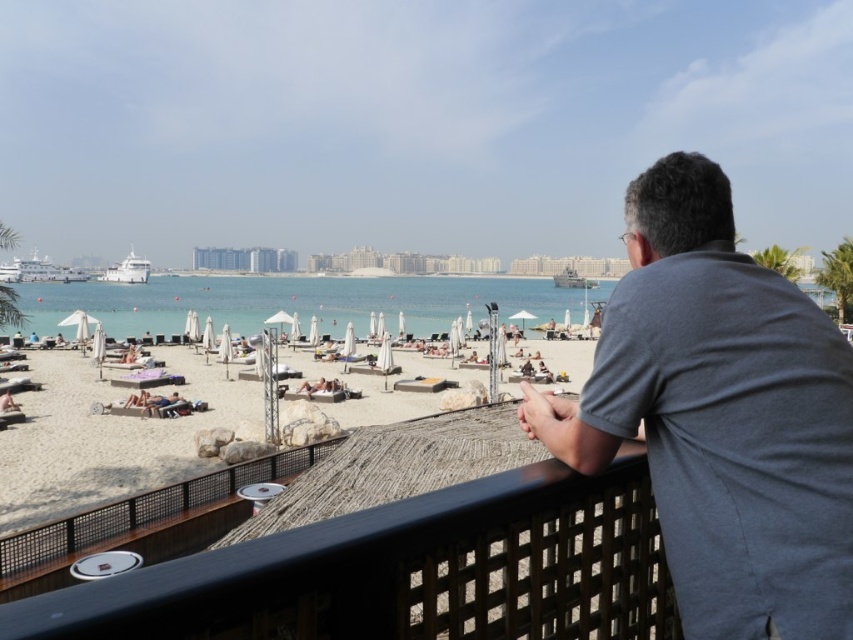
Who is positioned more to the left, gray cotton shirt at upper right or beige sand beach at center?

From the viewer's perspective, beige sand beach at center appears more on the left side.

Is point (747, 506) positioned before point (161, 426)?

Yes, point (747, 506) is closer to viewer.

Where is `gray cotton shirt at upper right`? The width and height of the screenshot is (853, 640). gray cotton shirt at upper right is located at coordinates (721, 416).

Is point (659, 445) less distant than point (12, 404)?

Yes, point (659, 445) is closer to viewer.

Can you confirm if gray cotton shirt at upper right is positioned to the right of tan skin person at lower left?

Indeed, gray cotton shirt at upper right is positioned on the right side of tan skin person at lower left.

Does point (801, 483) lie in front of point (18, 408)?

Yes, point (801, 483) is in front of point (18, 408).

Where is `gray cotton shirt at upper right`? This screenshot has height=640, width=853. gray cotton shirt at upper right is located at coordinates (721, 416).

Is gray cotton shirt at upper right closer to the viewer compared to clear blue water at center?

Yes, gray cotton shirt at upper right is in front of clear blue water at center.

Between point (798, 497) and point (515, 291), which one is positioned in front?

Point (798, 497)

Does point (746, 618) come closer to viewer compared to point (166, 316)?

Yes, point (746, 618) is closer to viewer.

The image size is (853, 640). I want to click on gray cotton shirt at upper right, so click(721, 416).